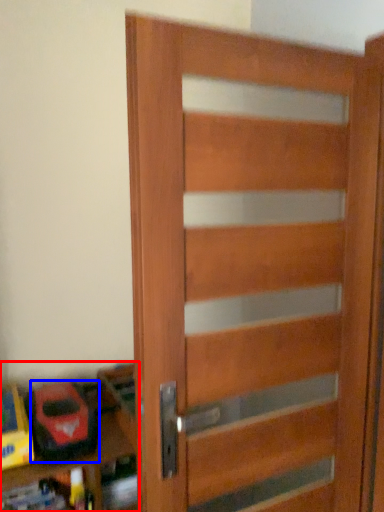
Question: Which object is closer to the camera taking this photo, shelf (highlighted by a red box) or toy (highlighted by a blue box)?

Choices:
 (A) shelf
 (B) toy

Answer: (A)